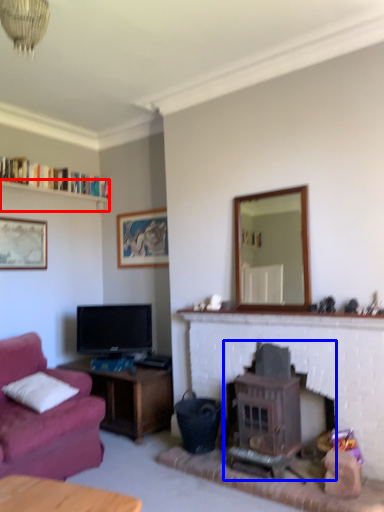
Question: Which point is closer to the camera, shelf (highlighted by a red box) or wood burning stove (highlighted by a blue box)?

Choices:
 (A) shelf
 (B) wood burning stove

Answer: (B)